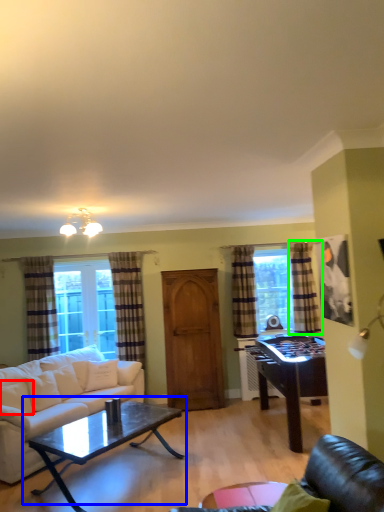
Question: Which is farther away from pillow (highlighted by a red box)? coffee table (highlighted by a blue box) or curtain (highlighted by a green box)?

Choices:
 (A) coffee table
 (B) curtain

Answer: (B)